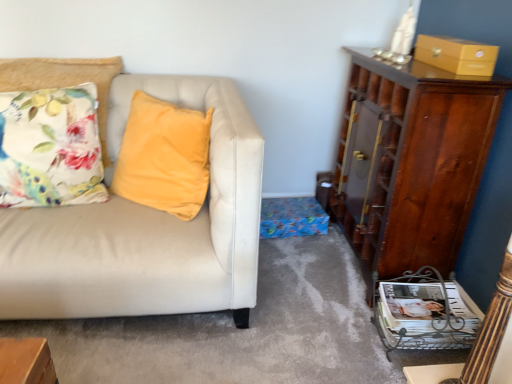
Find the location of `vacant space situated on the left part of white glossy magazine at lower right`. vacant space situated on the left part of white glossy magazine at lower right is located at coordinates (350, 328).